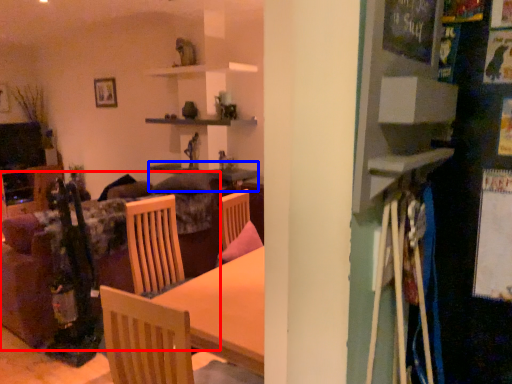
Question: Which object is further to the camera taking this photo, couch (highlighted by a red box) or table (highlighted by a blue box)?

Choices:
 (A) couch
 (B) table

Answer: (B)